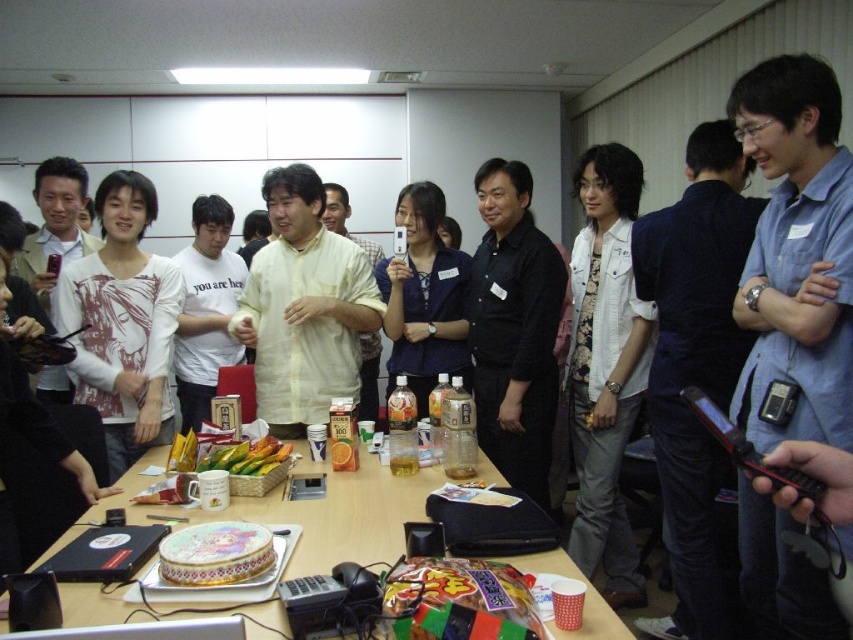
You are standing at the entrance of the room and see two points marked in the image. Which point is closer to you, point (729,237) or point (375,396)?

Point (729,237) is in front of point (375,396), so it is closer to you.

You are a guest at this event and want to place your white denim jacket at center on the smooth wooden table at center. Is there enough space for it?

The white denim jacket at center is already placed above the smooth wooden table at center, so there is space for it.

You are at the center of the room and see both the blue shirt at center and the matte yellow shirt at center. Which shirt is taller?

The blue shirt at center is taller than the matte yellow shirt at center.